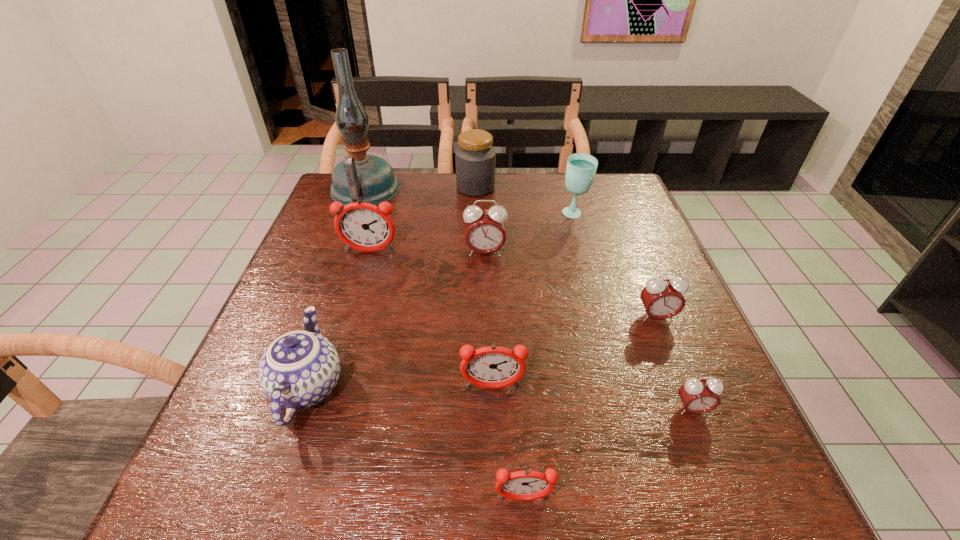
Find the location of a particular element. blank space located 0.270m on the front-facing side of the biggest reddish-pink alarm clock is located at coordinates (344, 341).

Find the location of a particular element. vacant space situated at the spout of the chinaware is located at coordinates (340, 292).

Identify the location of free region located 0.130m at the spout of the chinaware. (339, 295).

At what (x,y) coordinates should I click in order to perform the action: click on free location located 0.170m at the spout of the chinaware. Please return your answer as a coordinate pair (x, y). Looking at the image, I should click on (344, 283).

The height and width of the screenshot is (540, 960). I want to click on vacant position located on the clock face of the fourth nearest alarm clock, so click(716, 464).

At what (x,y) coordinates should I click in order to perform the action: click on free location located 0.150m on the front-facing side of the second smallest reddish-pink alarm clock. Please return your answer as a coordinate pair (x, y). The image size is (960, 540). Looking at the image, I should click on (494, 477).

Locate an element on the screen. free space located 0.070m on the clock face of the nearest pink alarm clock is located at coordinates tap(711, 456).

Locate an element on the screen. Image resolution: width=960 pixels, height=540 pixels. oil lamp situated at the far edge is located at coordinates (369, 178).

Locate an element on the screen. The image size is (960, 540). jar at the far edge is located at coordinates (475, 157).

Where is `glass at the far edge`? The image size is (960, 540). glass at the far edge is located at coordinates (581, 168).